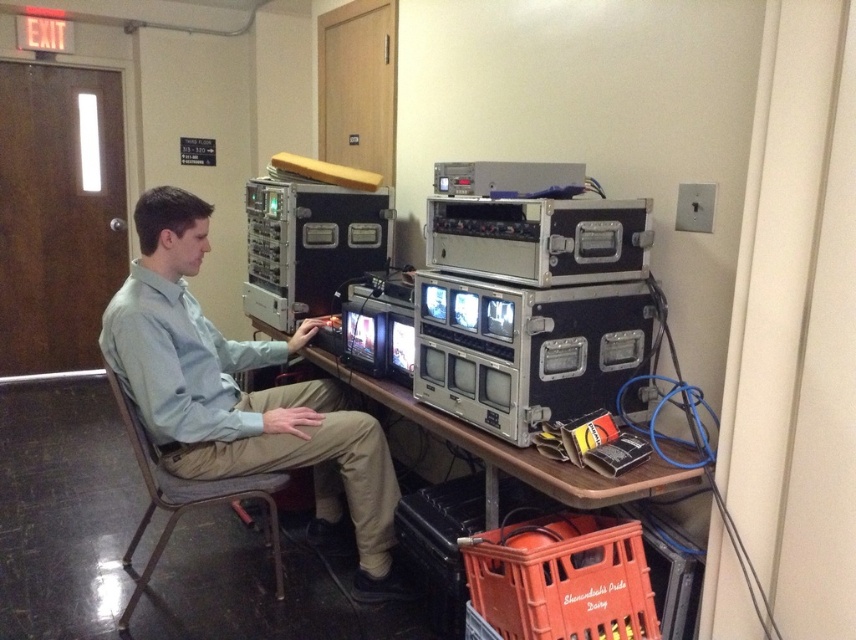
Between point (488, 509) and point (140, 464), which one is positioned in front?

Point (488, 509) is more forward.

Locate an element on the screen. wooden table at center is located at coordinates (515, 452).

Find the location of a particular element. wooden table at center is located at coordinates (515, 452).

How far apart are orange plastic crate at lower right and gray fabric chair at center?

orange plastic crate at lower right and gray fabric chair at center are 39.06 inches apart.

Looking at this image, which of these two, orange plastic crate at lower right or gray fabric chair at center, stands shorter?

Standing shorter between the two is orange plastic crate at lower right.

Describe the element at coordinates (562, 579) in the screenshot. I see `orange plastic crate at lower right` at that location.

I want to click on orange plastic crate at lower right, so click(x=562, y=579).

Is point (200, 317) behind point (645, 561)?

Yes, it is behind point (645, 561).

Is point (221, 374) positioned in front of point (501, 602)?

No.

Locate an element on the screen. light blue shirt at center is located at coordinates (242, 396).